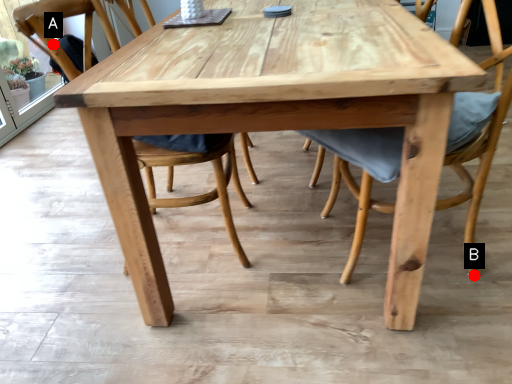
Question: Two points are circled on the image, labeled by A and B beside each circle. Which point is closer to the camera taking this photo?

Choices:
 (A) A is closer
 (B) B is closer

Answer: (A)